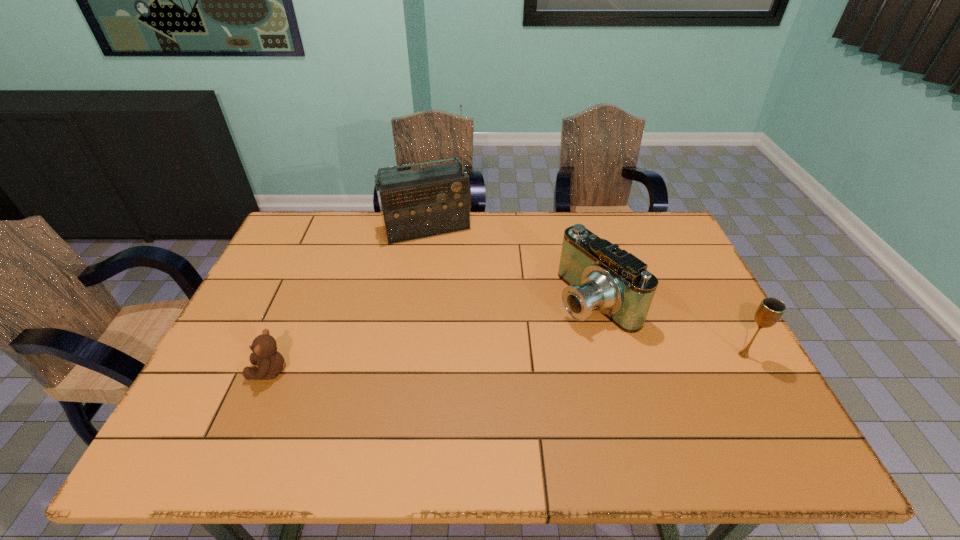
Identify the location of teddy bear. The height and width of the screenshot is (540, 960). (270, 362).

The height and width of the screenshot is (540, 960). What are the coordinates of `the leftmost object` in the screenshot? It's located at (270, 362).

This screenshot has height=540, width=960. Find the location of `the rightmost object`. the rightmost object is located at coordinates (770, 310).

Where is `the tallest object`? Image resolution: width=960 pixels, height=540 pixels. the tallest object is located at coordinates (435, 200).

Locate an element on the screen. the farthest object is located at coordinates (435, 200).

This screenshot has height=540, width=960. I want to click on the third nearest object, so click(601, 276).

This screenshot has height=540, width=960. I want to click on camcorder, so click(x=601, y=276).

Locate an element on the screen. The image size is (960, 540). vacant space located 0.090m on the face of the leftmost object is located at coordinates (214, 371).

This screenshot has width=960, height=540. I want to click on vacant region located on the face of the leftmost object, so tap(223, 371).

The height and width of the screenshot is (540, 960). In order to click on free space located on the front of the chalice in this screenshot , I will do `click(763, 391)`.